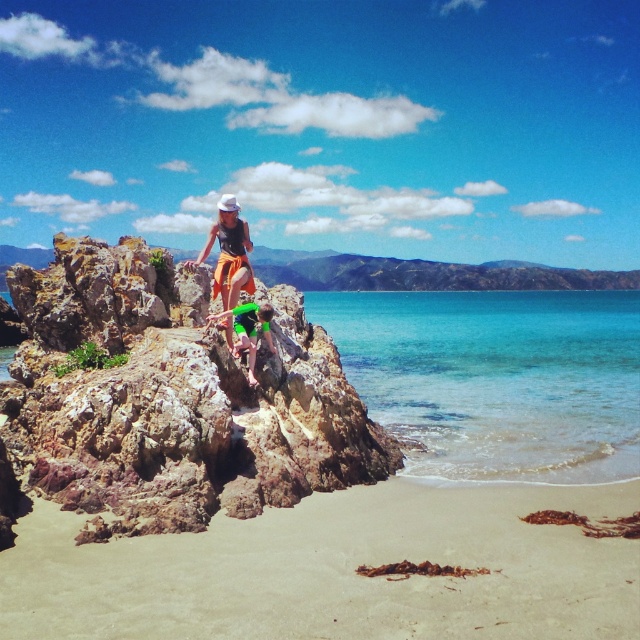
You are standing on the beach looking at the rocky outcrop. Which object is located at the coordinates point (172, 403)?

The point (172, 403) corresponds to the rusty rock at center.

You are a photographer trying to capture a photo of the rusty rock at center and the matte orange shorts at center. Which object should you focus on first if you want to ensure both are in frame without moving the camera?

You should focus on the rusty rock at center first because it occupies less space than the matte orange shorts at center, so it will be easier to fit both into the frame by starting with the smaller object.